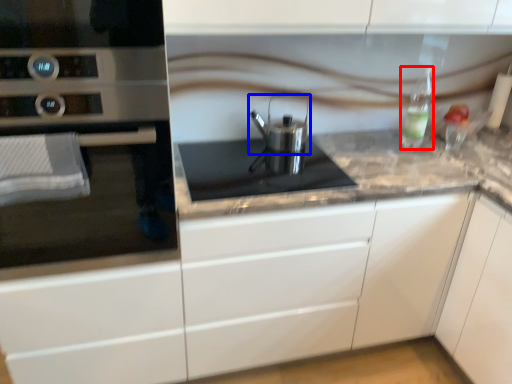
Question: Which of the following is the farthest to the observer, bottle (highlighted by a red box) or kitchen appliance (highlighted by a blue box)?

Choices:
 (A) bottle
 (B) kitchen appliance

Answer: (A)